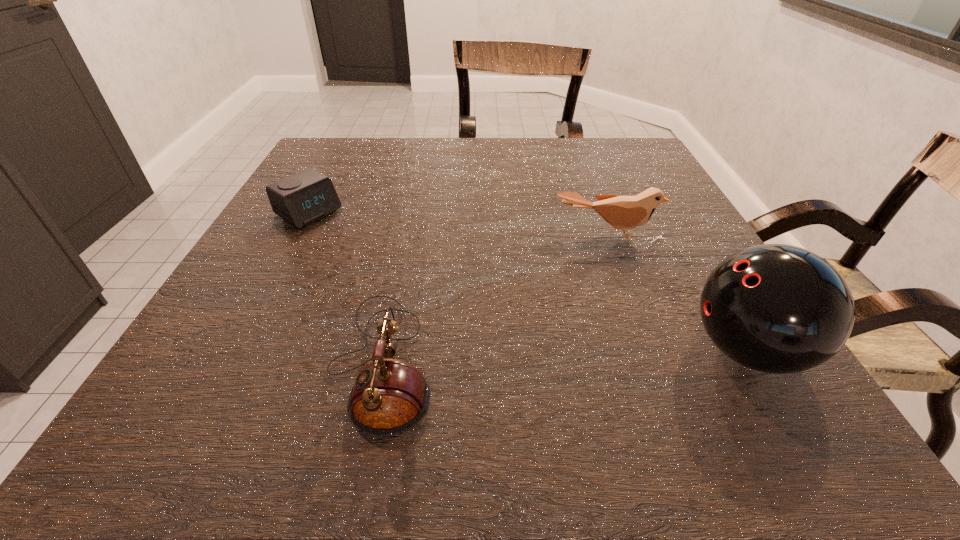
Identify the location of free space that is in between the third object from right to left and the bird. The image size is (960, 540). (495, 298).

The width and height of the screenshot is (960, 540). In order to click on free space that is in between the bowling ball and the shortest object in this screenshot , I will do `click(528, 281)`.

Find the location of `free space between the alarm clock and the bowling ball`. free space between the alarm clock and the bowling ball is located at coordinates (528, 281).

Where is `vacant space that is in between the bowling ball and the third object from right to left`? vacant space that is in between the bowling ball and the third object from right to left is located at coordinates (564, 356).

In order to click on empty space that is in between the bowling ball and the telephone in this screenshot , I will do `click(564, 356)`.

At what (x,y) coordinates should I click in order to perform the action: click on vacant area between the shortest object and the bird. Please return your answer as a coordinate pair (x, y). Looking at the image, I should click on (459, 224).

Image resolution: width=960 pixels, height=540 pixels. Identify the location of free space between the bowling ball and the third object from right to left. (564, 356).

Where is `free spot between the tallest object and the second object from left to right`? The image size is (960, 540). free spot between the tallest object and the second object from left to right is located at coordinates (564, 356).

You are a GUI agent. You are given a task and a screenshot of the screen. Output one action in this format:
    pyautogui.click(x=<x>, y=<y>)
    Task: Click on the unoccupied position between the telephone and the leftmost object
    The width and height of the screenshot is (960, 540).
    Given the screenshot: What is the action you would take?
    pyautogui.click(x=346, y=287)

Find the location of `vacant space that is in between the telephone and the bird`. vacant space that is in between the telephone and the bird is located at coordinates (495, 298).